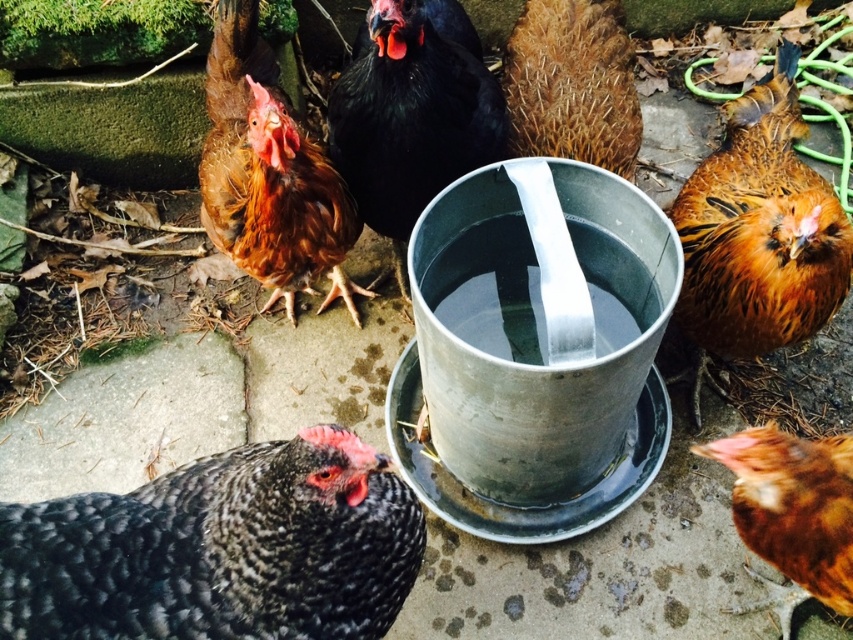
Can you confirm if brown feathered chicken at upper left is shorter than brown speckled feathers at lower right?

Incorrect, brown feathered chicken at upper left's height does not fall short of brown speckled feathers at lower right's.

Between brown feathered chicken at upper left and brown speckled feathers at lower right, which one has less height?

Standing shorter between the two is brown speckled feathers at lower right.

The image size is (853, 640). In order to click on brown feathered chicken at upper left in this screenshot , I will do `click(268, 173)`.

Find the location of a particular element. This screenshot has height=640, width=853. brown feathered chicken at upper left is located at coordinates (268, 173).

Does brown feathered chicken at upper left have a lesser height compared to brown textured feathers at center?

Incorrect, brown feathered chicken at upper left's height does not fall short of brown textured feathers at center's.

Is brown feathered chicken at upper left to the left of brown textured feathers at center from the viewer's perspective?

Yes, brown feathered chicken at upper left is to the left of brown textured feathers at center.

You are a GUI agent. You are given a task and a screenshot of the screen. Output one action in this format:
    pyautogui.click(x=<x>, y=<y>)
    Task: Click on the brown feathered chicken at upper left
    The height and width of the screenshot is (640, 853).
    Given the screenshot: What is the action you would take?
    pyautogui.click(x=268, y=173)

You are a GUI agent. You are given a task and a screenshot of the screen. Output one action in this format:
    pyautogui.click(x=<x>, y=<y>)
    Task: Click on the brown feathered chicken at upper left
    This screenshot has width=853, height=640.
    Given the screenshot: What is the action you would take?
    pyautogui.click(x=268, y=173)

Can you confirm if brown speckled feathers at right is smaller than brown speckled feathers at lower right?

No.

Is brown speckled feathers at right to the left of brown speckled feathers at lower right from the viewer's perspective?

In fact, brown speckled feathers at right is to the right of brown speckled feathers at lower right.

Describe the element at coordinates (758, 234) in the screenshot. I see `brown speckled feathers at right` at that location.

Image resolution: width=853 pixels, height=640 pixels. Find the location of `brown speckled feathers at right`. brown speckled feathers at right is located at coordinates (758, 234).